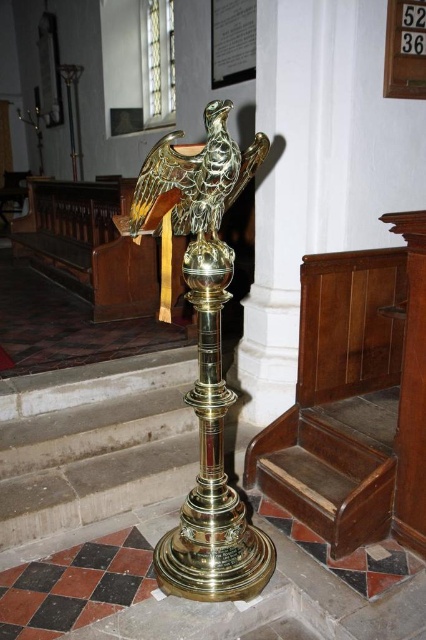
You are an interior designer planning to place a decorative item between the polished brass lectern at center and the gold polished eagle at center. Considering their sizes, which object should you place the item closer to to ensure it doesn

The polished brass lectern at center is wider than the gold polished eagle at center. Therefore, placing the decorative item closer to the polished brass lectern at center would provide more space for the item to fit comfortably between them.

In the scene shown: You are an interior designer planning to place a new decorative item between the polished brass lectern at center and the gold polished eagle at center. Since the lectern is larger, which object should you consider moving closer to the entrance to maintain balance?

Since the polished brass lectern at center is bigger than the gold polished eagle at center, you should move the gold polished eagle at center closer to the entrance to balance their sizes.

You are a visitor standing at the entrance of the church. You see the polished brass lectern at center and the gold polished eagle at center. Which object is taller?

The polished brass lectern at center is taller than the gold polished eagle at center.